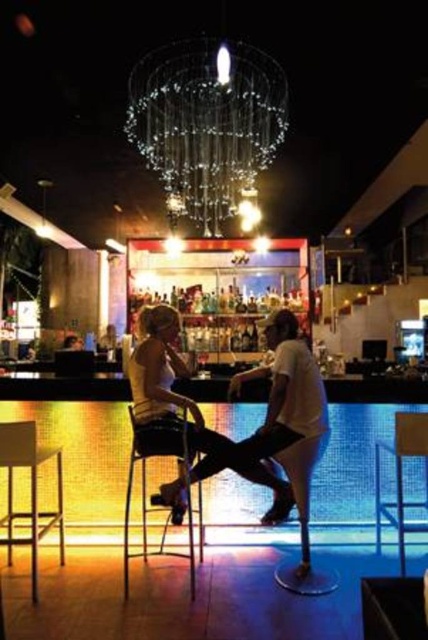
Question: Can you confirm if metallic silver bar stool at lower left is positioned to the left of metallic silver chair at lower center?

Choices:
 (A) no
 (B) yes

Answer: (B)

Question: Can you confirm if matte white shirt at center is bigger than metallic silver bar stool at lower left?

Choices:
 (A) no
 (B) yes

Answer: (B)

Question: Which point is closer to the camera?

Choices:
 (A) 383,445
 (B) 243,442
 (C) 127,545

Answer: (C)

Question: Does clear glass chandelier at upper center appear under metallic silver stool at lower center?

Choices:
 (A) no
 (B) yes

Answer: (A)

Question: Among these points, which one is farthest from the camera?

Choices:
 (A) (128, 470)
 (B) (249, 74)
 (C) (177, 397)
 (D) (20, 436)

Answer: (B)

Question: Among these points, which one is farthest from the camera?

Choices:
 (A) (6, 547)
 (B) (270, 477)
 (C) (401, 449)
 (D) (139, 435)

Answer: (A)